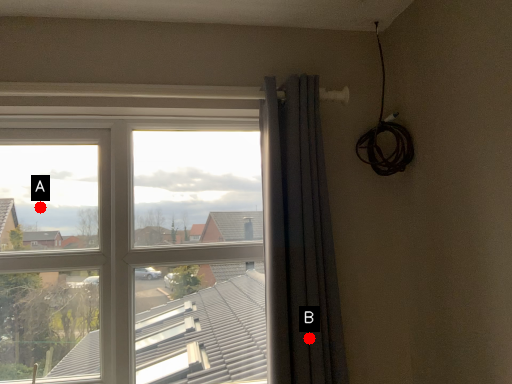
Question: Two points are circled on the image, labeled by A and B beside each circle. Which point is closer to the camera?

Choices:
 (A) A is closer
 (B) B is closer

Answer: (B)